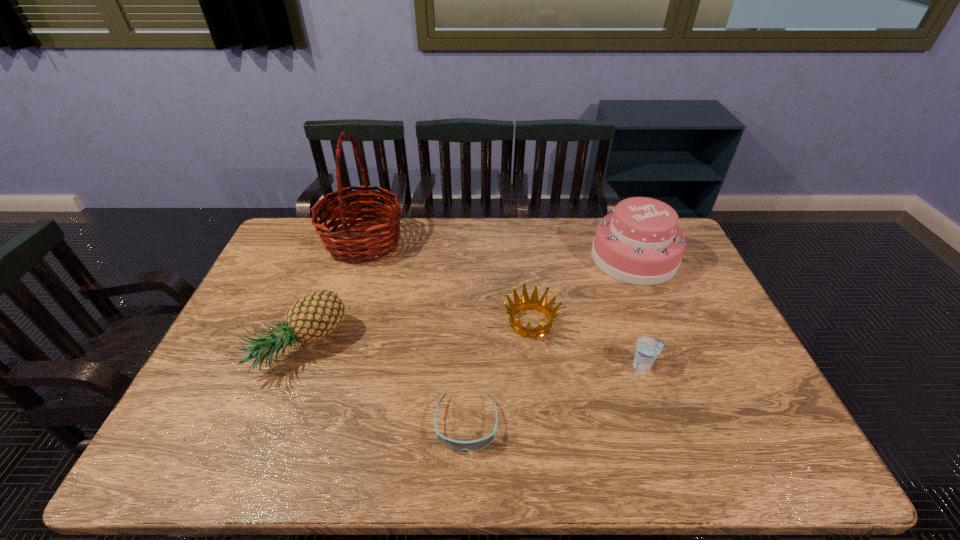
Locate an element on the screen. Image resolution: width=960 pixels, height=540 pixels. vacant area situated on the front of the third object from right to left is located at coordinates (542, 421).

You are a GUI agent. You are given a task and a screenshot of the screen. Output one action in this format:
    pyautogui.click(x=<x>, y=<y>)
    Task: Click on the free spot located 0.050m on the left of the yogurt
    The width and height of the screenshot is (960, 540).
    Given the screenshot: What is the action you would take?
    coord(612,365)

This screenshot has width=960, height=540. I want to click on basket at the far edge, so pyautogui.click(x=373, y=243).

The height and width of the screenshot is (540, 960). Identify the location of cake located at the far edge. (639, 243).

Locate an element on the screen. The width and height of the screenshot is (960, 540). object present at the near edge is located at coordinates (455, 445).

You are a GUI agent. You are given a task and a screenshot of the screen. Output one action in this format:
    pyautogui.click(x=<x>, y=<y>)
    Task: Click on the basket that is at the left edge
    This screenshot has height=540, width=960.
    Given the screenshot: What is the action you would take?
    pyautogui.click(x=373, y=243)

Identify the location of pineapple located in the left edge section of the desktop. [314, 316].

Image resolution: width=960 pixels, height=540 pixels. In order to click on object present at the right edge in this screenshot , I will do `click(639, 243)`.

Identify the location of object at the far left corner. (373, 243).

Image resolution: width=960 pixels, height=540 pixels. I want to click on object situated at the far right corner, so click(x=639, y=243).